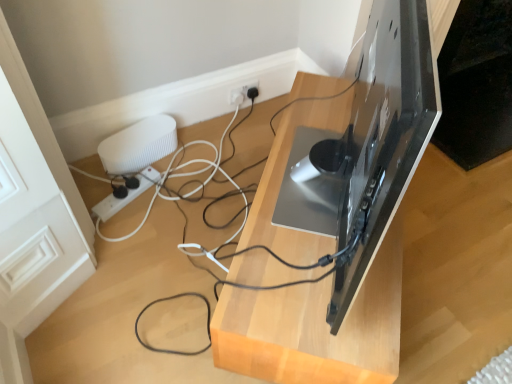
The image size is (512, 384). Describe the element at coordinates (315, 328) in the screenshot. I see `matte black tv stand at center` at that location.

Find the location of a particular element. The height and width of the screenshot is (384, 512). white plastic power strip at lower left is located at coordinates (127, 194).

Is white ribbed speaker at left oriented away from white plastic power strip at lower left?

That's not correct — white ribbed speaker at left is not looking away from white plastic power strip at lower left.

Which of these two, white ribbed speaker at left or white plastic power strip at lower left, is bigger?

white ribbed speaker at left is bigger.

Is white ribbed speaker at left further to camera compared to white plastic power strip at lower left?

Yes, the depth of white ribbed speaker at left is greater than that of white plastic power strip at lower left.

How much distance is there between white ribbed speaker at left and white plastic power strip at lower left?

4.63 inches.

Could you tell me if white plastic power strip at lower left is facing white ribbed speaker at left?

No, white plastic power strip at lower left is not turned towards white ribbed speaker at left.

How different are the orientations of white plastic power strip at lower left and white ribbed speaker at left in degrees?

3.19 degrees separate the facing orientations of white plastic power strip at lower left and white ribbed speaker at left.

Considering the relative positions of white plastic power strip at lower left and white ribbed speaker at left in the image provided, is white plastic power strip at lower left to the right of white ribbed speaker at left from the viewer's perspective?

Incorrect, white plastic power strip at lower left is not on the right side of white ribbed speaker at left.

From the image's perspective, does white plastic power strip at lower left appear higher than white ribbed speaker at left?

No, from the image's perspective, white plastic power strip at lower left is not above white ribbed speaker at left.

Is matte black tv stand at center facing towards white ribbed speaker at left?

No, matte black tv stand at center is not aimed at white ribbed speaker at left.

In the image, is matte black tv stand at center positioned in front of or behind white ribbed speaker at left?

matte black tv stand at center is in front of white ribbed speaker at left.

What's the angular difference between matte black tv stand at center and white ribbed speaker at left's facing directions?

26.7 degrees.

Between matte black tv stand at center and white ribbed speaker at left, which one appears on the left side from the viewer's perspective?

Positioned to the left is white ribbed speaker at left.

From the picture: From the image's perspective, who appears lower, white plastic power strip at lower left or matte black tv stand at center?

From the image's view, matte black tv stand at center is below.

Considering the sizes of white plastic power strip at lower left and matte black tv stand at center in the image, is white plastic power strip at lower left bigger or smaller than matte black tv stand at center?

Clearly, white plastic power strip at lower left is smaller in size than matte black tv stand at center.

Where is `extension cord on the left of matte black tv stand at center`? extension cord on the left of matte black tv stand at center is located at coordinates (127, 194).

What's the angular difference between white plastic power strip at lower left and matte black tv stand at center's facing directions?

The angle between the facing direction of white plastic power strip at lower left and the facing direction of matte black tv stand at center is 23.5 degrees.

How different are the orientations of white ribbed speaker at left and matte black tv stand at center in degrees?

white ribbed speaker at left and matte black tv stand at center are facing 26.7 degrees away from each other.

Relative to matte black tv stand at center, is white ribbed speaker at left in front or behind?

Visually, white ribbed speaker at left is located behind matte black tv stand at center.

Is point (148, 128) closer or farther from the camera than point (277, 130)?

Point (148, 128).

From the image's perspective, is white ribbed speaker at left below matte black tv stand at center?

No.

From the picture: Is matte black tv stand at center facing away from white plastic power strip at lower left?

Yes.

Which is in front, point (319, 359) or point (113, 201)?

Positioned in front is point (319, 359).

Could white plastic power strip at lower left be considered to be inside matte black tv stand at center?

No, white plastic power strip at lower left is not surrounded by matte black tv stand at center.

From a real-world perspective, is matte black tv stand at center positioned under white plastic power strip at lower left based on gravity?

No, from a real-world perspective, matte black tv stand at center is not below white plastic power strip at lower left.

At what (x,y) coordinates should I click in order to perform the action: click on extension cord below the white ribbed speaker at left (from the image's perspective). Please return your answer as a coordinate pair (x, y). The height and width of the screenshot is (384, 512). Looking at the image, I should click on (127, 194).

Image resolution: width=512 pixels, height=384 pixels. I want to click on appliance behind the white plastic power strip at lower left, so click(139, 145).

Estimate the real-world distances between objects in this image. Which object is closer to matte black tv stand at center, white plastic power strip at lower left or white ribbed speaker at left?

Among the two, white ribbed speaker at left is located nearer to matte black tv stand at center.

From the image, which object appears to be nearer to white plastic power strip at lower left, matte black tv stand at center or white ribbed speaker at left?

white ribbed speaker at left lies closer to white plastic power strip at lower left than the other object.

From the picture: Looking at the image, which one is located closer to white ribbed speaker at left, matte black tv stand at center or white plastic power strip at lower left?

white plastic power strip at lower left.

Which object lies further to the anchor point white ribbed speaker at left, white plastic power strip at lower left or matte black tv stand at center?

matte black tv stand at center is further to white ribbed speaker at left.

Considering their positions, is white ribbed speaker at left positioned further to white plastic power strip at lower left than matte black tv stand at center?

matte black tv stand at center is further to white plastic power strip at lower left.

Based on the photo, from the image, which object appears to be nearer to matte black tv stand at center, white ribbed speaker at left or white plastic power strip at lower left?

white ribbed speaker at left.

Locate an element on the screen. Image resolution: width=512 pixels, height=384 pixels. appliance situated between white plastic power strip at lower left and matte black tv stand at center from left to right is located at coordinates [139, 145].